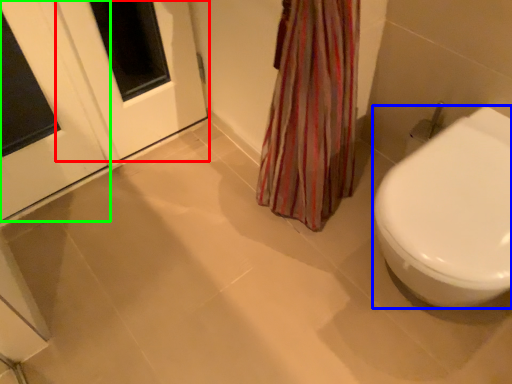
Question: Considering the real-world distances, which object is farthest from screen door (highlighted by a red box)? bidet (highlighted by a blue box) or door (highlighted by a green box)?

Choices:
 (A) bidet
 (B) door

Answer: (A)